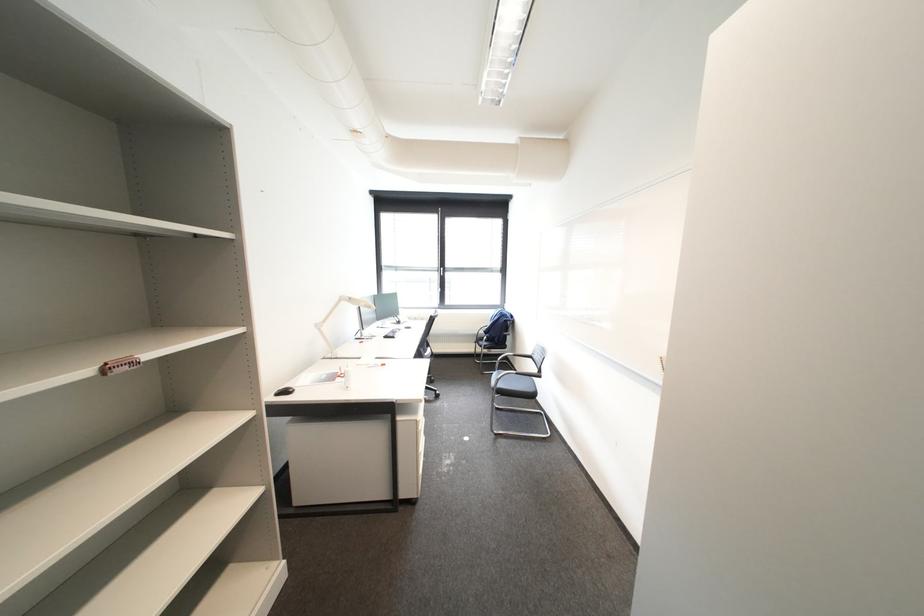
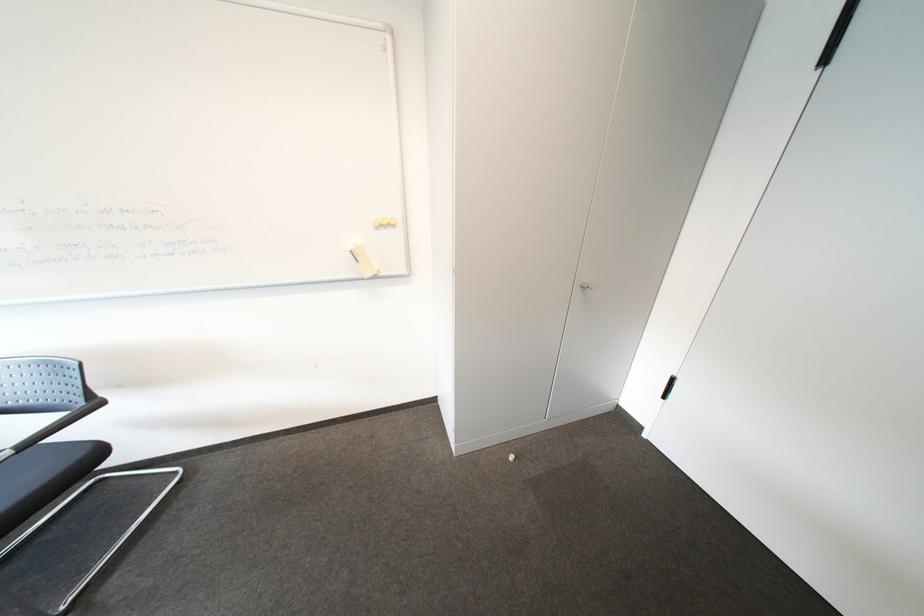
In the scene shown: How did the camera likely rotate?

The camera's rotation is toward right-down.